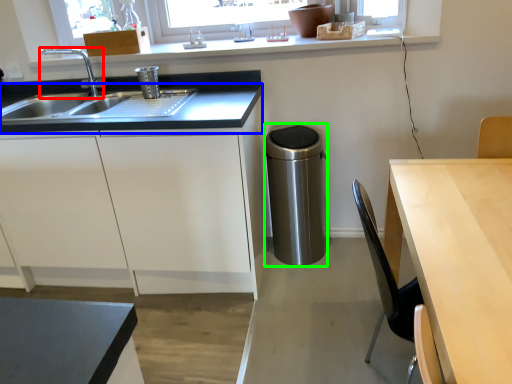
Question: Which object is the closest to the tap (highlighted by a red box)? Choose among these: countertop (highlighted by a blue box) or appliance (highlighted by a green box).

Choices:
 (A) countertop
 (B) appliance

Answer: (A)